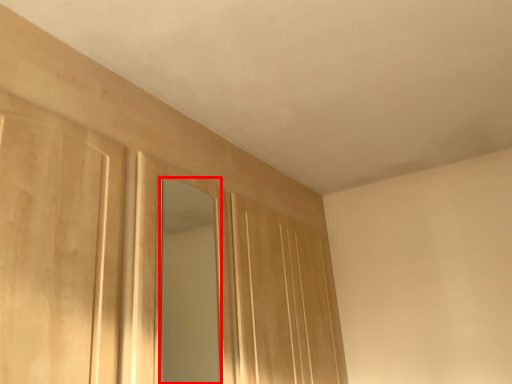
Question: Where is mirror (annotated by the red box) located in relation to door in the image?

Choices:
 (A) left
 (B) right

Answer: (A)